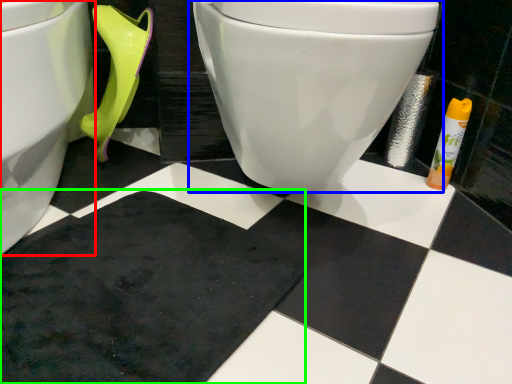
Question: Based on their relative distances, which object is nearer to toilet (highlighted by a red box)? Choose from toilet (highlighted by a blue box) and bath mat (highlighted by a green box).

Choices:
 (A) toilet
 (B) bath mat

Answer: (B)